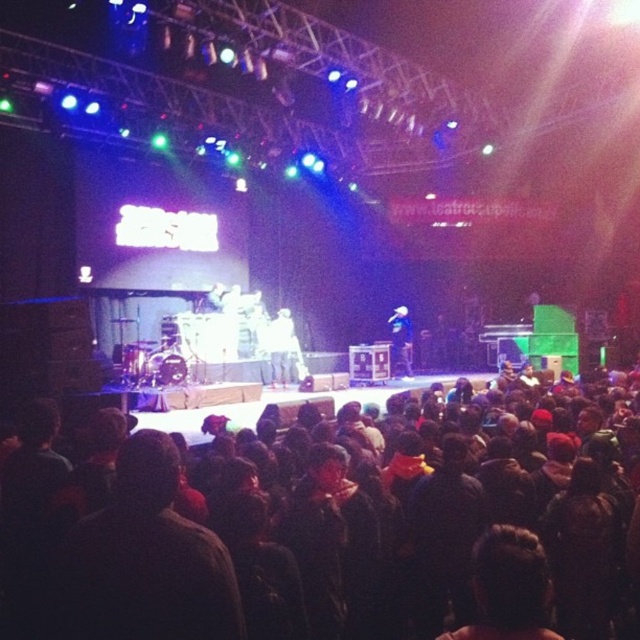
Is dark fabric crowd at center smaller than dark brown hair at center?

No, dark fabric crowd at center is not smaller than dark brown hair at center.

Is dark fabric crowd at center below dark brown hair at center?

Correct, dark fabric crowd at center is located below dark brown hair at center.

Is point (332, 452) positioned before point (104, 596)?

No.

The width and height of the screenshot is (640, 640). I want to click on dark fabric crowd at center, so click(x=339, y=532).

Can you confirm if dark brown hair at center is shorter than shiny blue jacket at center?

Indeed, dark brown hair at center has a lesser height compared to shiny blue jacket at center.

Who is shorter, dark brown hair at center or shiny blue jacket at center?

Standing shorter between the two is dark brown hair at center.

Image resolution: width=640 pixels, height=640 pixels. Find the location of `dark brown hair at center`. dark brown hair at center is located at coordinates (145, 561).

Is the position of dark fabric crowd at center more distant than that of shiny blue jacket at center?

No, it is in front of shiny blue jacket at center.

Who is more forward, (582, 502) or (403, 316)?

Point (582, 502) is more forward.

Consider the image. Who is more distant from viewer, (x=620, y=588) or (x=404, y=332)?

Point (x=404, y=332)

You are a GUI agent. You are given a task and a screenshot of the screen. Output one action in this format:
    pyautogui.click(x=<x>, y=<y>)
    Task: Click on the dark fabric crowd at center
    
    Given the screenshot: What is the action you would take?
    pyautogui.click(x=339, y=532)